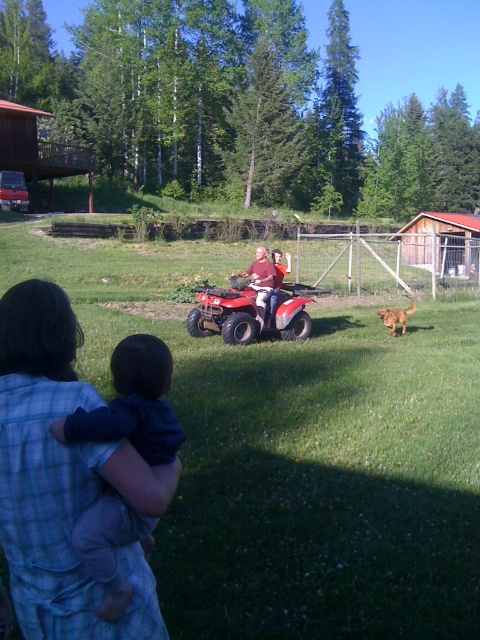
Based on the scene description, can you determine which object occupies more space in the image between the green grass at center and the matte red quad bike at center?

The green grass at center has a larger size compared to the matte red quad bike at center, so it occupies more space in the image.

You are a photographer standing at the position of the person with the child. You want to take a photo of the matte red quad bike at center and the golden fur dog at right. Can you fit both subjects in the frame if your camera has a 10 feet wide field of view?

The distance between the matte red quad bike at center and the golden fur dog at right is 9.62 feet, which is less than the 10 feet field of view. Therefore, both subjects can be captured in the same frame.